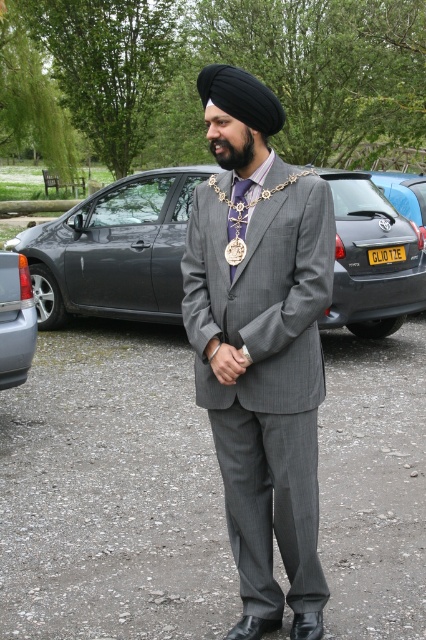
Question: Is purple satin tie at center to the right of yellow metallic license plate at center from the viewer's perspective?

Choices:
 (A) no
 (B) yes

Answer: (A)

Question: Does gray pinstripe suit at center appear under metallic gray car at left?

Choices:
 (A) no
 (B) yes

Answer: (B)

Question: Can you confirm if purple satin tie at center is bigger than yellow metallic license plate at center?

Choices:
 (A) yes
 (B) no

Answer: (B)

Question: Which object is closer to the camera taking this photo?

Choices:
 (A) yellow metallic license plate at center
 (B) gray metallic car at center

Answer: (A)

Question: Estimate the real-world distances between objects in this image. Which object is closer to the yellow metallic license plate at center?

Choices:
 (A) gray pinstripe suit at center
 (B) blue metallic car at center

Answer: (B)

Question: Which object is the closest to the yellow metallic license plate at center?

Choices:
 (A) purple satin tie at center
 (B) black fuzzy beard at center
 (C) blue metallic car at center
 (D) gray pinstripe suit at center

Answer: (C)